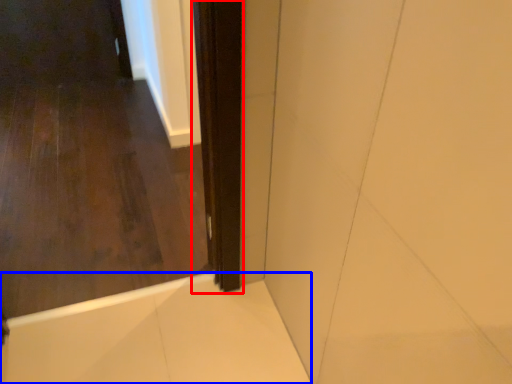
Question: Among these objects, which one is farthest to the camera, screen door (highlighted by a red box) or bath (highlighted by a blue box)?

Choices:
 (A) screen door
 (B) bath

Answer: (B)